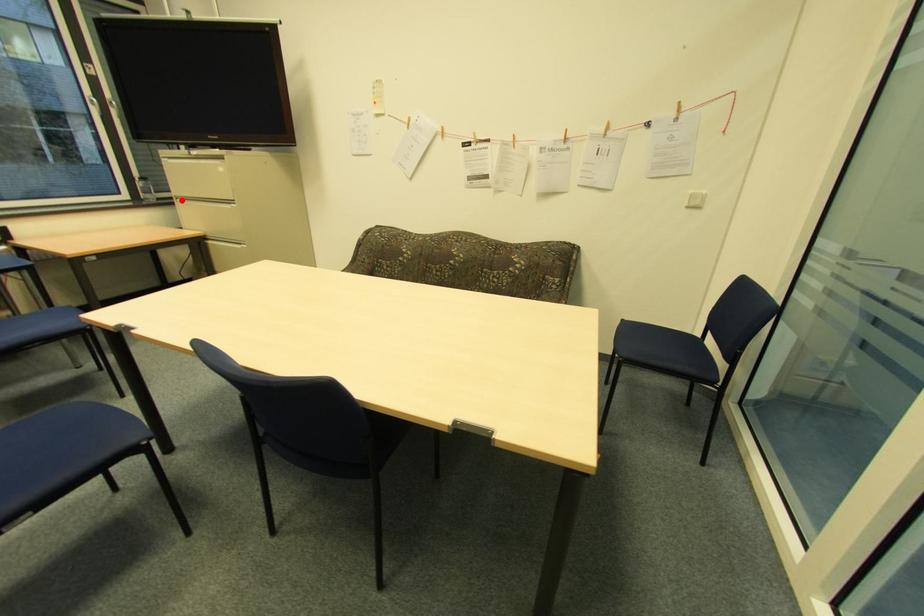
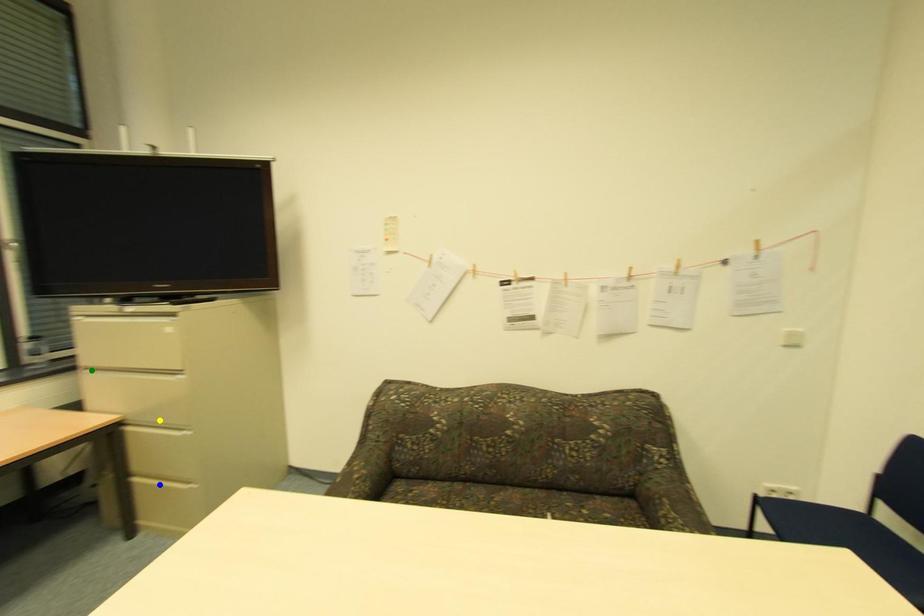
Question: I am providing you with two images of the same scene from different viewpoints. A red point is marked on the first image. You are given multiple points on the second image. Which mark in image 2 goes with the point in image 1?

Choices:
 (A) yellow point
 (B) green point
 (C) blue point

Answer: (B)